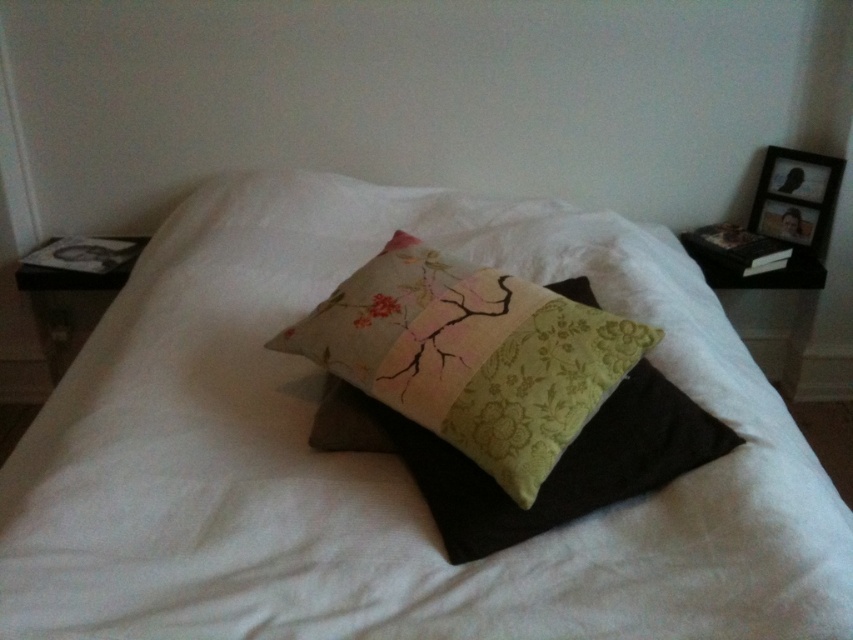
Question: Which of the following is the closest to the observer?

Choices:
 (A) patchwork fabric cushion at center
 (B) textured cotton bed at center

Answer: (B)

Question: From the image, what is the correct spatial relationship of textured cotton bed at center in relation to patchwork fabric cushion at center?

Choices:
 (A) right
 (B) left

Answer: (A)

Question: Can you confirm if textured cotton bed at center is positioned below patchwork fabric cushion at center?

Choices:
 (A) yes
 (B) no

Answer: (B)

Question: Which point is closer to the camera taking this photo?

Choices:
 (A) (36, 636)
 (B) (412, 326)

Answer: (A)

Question: Does textured cotton bed at center appear on the left side of patchwork fabric cushion at center?

Choices:
 (A) yes
 (B) no

Answer: (B)

Question: Which point appears farthest from the camera in this image?

Choices:
 (A) (572, 561)
 (B) (473, 273)

Answer: (B)